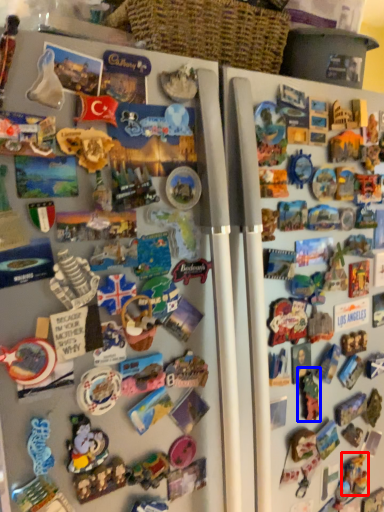
Question: Which object is further to the camera taking this photo, toy (highlighted by a red box) or toy (highlighted by a blue box)?

Choices:
 (A) toy
 (B) toy

Answer: (A)